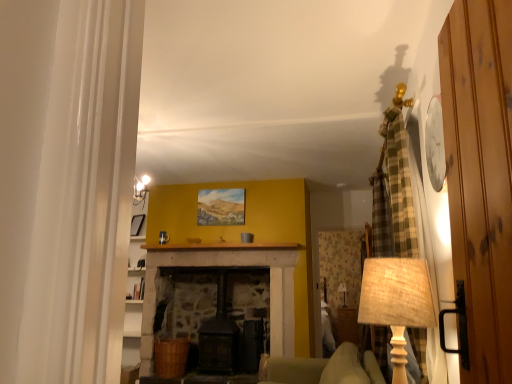
Locate an element on the screen. soft beige fabric armchair at center is located at coordinates (325, 369).

Find the location of `matte black picture frame at left`. matte black picture frame at left is located at coordinates pos(136,224).

You are a GUI agent. You are given a task and a screenshot of the screen. Output one action in this format:
    pyautogui.click(x=<x>, y=<y>)
    Task: Click on the wooden door at right
    
    Given the screenshot: What is the action you would take?
    pyautogui.click(x=480, y=175)

Which object is positioned more to the left, matte beige lampshade at center, which is the 2th table lamp in left-to-right order, or wooden door at right?

From the viewer's perspective, wooden door at right appears more on the left side.

From the image's perspective, does matte beige lampshade at center, which is counted as the second table lamp, starting from the front, appear lower than wooden door at right?

Yes, from the image's perspective, matte beige lampshade at center, which is counted as the second table lamp, starting from the front, is beneath wooden door at right.

Is matte beige lampshade at center, the first table lamp when ordered from back to front, in front of or behind wooden door at right in the image?

matte beige lampshade at center, the first table lamp when ordered from back to front, is behind wooden door at right.

Looking at the image, does matte beige lampshade at center, which is counted as the second table lamp, starting from the front, seem bigger or smaller compared to wooden door at right?

Considering their sizes, matte beige lampshade at center, which is counted as the second table lamp, starting from the front, takes up less space than wooden door at right.

Is burlap lampshade at right, which appears as the first table lamp when viewed from the front, outside of matte beige lampshade at center, which is the 2th table lamp in left-to-right order?

Yes, burlap lampshade at right, which appears as the first table lamp when viewed from the front, is not within matte beige lampshade at center, which is the 2th table lamp in left-to-right order.

From the image's perspective, which is above, burlap lampshade at right, acting as the second table lamp starting from the back, or matte beige lampshade at center, the first table lamp when ordered from back to front?

burlap lampshade at right, acting as the second table lamp starting from the back.

Which of these two, burlap lampshade at right, the 2th table lamp when ordered from bottom to top, or matte beige lampshade at center, which is counted as the second table lamp, starting from the front, is thinner?

matte beige lampshade at center, which is counted as the second table lamp, starting from the front, is thinner.

Considering the relative positions of burlap lampshade at right, marked as the first table lamp in a top-to-bottom arrangement, and matte beige lampshade at center, positioned as the 2th table lamp in top-to-bottom order, in the image provided, is burlap lampshade at right, marked as the first table lamp in a top-to-bottom arrangement, behind matte beige lampshade at center, positioned as the 2th table lamp in top-to-bottom order,?

That is False.

Which of these two, soft beige fabric armchair at center or burlap lampshade at right, which appears as the first table lamp when viewed from the front, is thinner?

Thinner between the two is burlap lampshade at right, which appears as the first table lamp when viewed from the front.

Who is smaller, soft beige fabric armchair at center or burlap lampshade at right, marked as the first table lamp in a top-to-bottom arrangement?

burlap lampshade at right, marked as the first table lamp in a top-to-bottom arrangement, is smaller.

This screenshot has height=384, width=512. Find the location of `armchair that appears below the burlap lampshade at right, acting as the second table lamp starting from the back (from a real-world perspective)`. armchair that appears below the burlap lampshade at right, acting as the second table lamp starting from the back (from a real-world perspective) is located at coordinates (325, 369).

Which object is positioned more to the right, burlap lampshade at right, marked as the first table lamp in a top-to-bottom arrangement, or wooden door at right?

From the viewer's perspective, burlap lampshade at right, marked as the first table lamp in a top-to-bottom arrangement, appears more on the right side.

Does burlap lampshade at right, acting as the second table lamp starting from the back, have a greater width compared to wooden door at right?

Yes, burlap lampshade at right, acting as the second table lamp starting from the back, is wider than wooden door at right.

Can you tell me how much burlap lampshade at right, the 2th table lamp when ordered from bottom to top, and wooden door at right differ in facing direction?

The angle between the facing direction of burlap lampshade at right, the 2th table lamp when ordered from bottom to top, and the facing direction of wooden door at right is 5.11 degrees.

Are burlap lampshade at right, which ranks as the second table lamp in right-to-left order, and wooden door at right located far from each other?

No, burlap lampshade at right, which ranks as the second table lamp in right-to-left order, is not far away from wooden door at right.

From a real-world perspective, who is located higher, burlap lampshade at right, which appears as the first table lamp when viewed from the front, or soft beige fabric armchair at center?

burlap lampshade at right, which appears as the first table lamp when viewed from the front, is physically above.

Between burlap lampshade at right, acting as the second table lamp starting from the back, and soft beige fabric armchair at center, which one is positioned in front?

burlap lampshade at right, acting as the second table lamp starting from the back, is more forward.

Find the location of a particular element. This screenshot has height=384, width=512. armchair that appears on the left of burlap lampshade at right, which ranks as the second table lamp in right-to-left order is located at coordinates (325, 369).

How much distance is there between matte beige lampshade at center, which is the 2th table lamp in left-to-right order, and burlap lampshade at right, which ranks as the second table lamp in right-to-left order?

They are 10.87 feet apart.

Is matte beige lampshade at center, the first table lamp from the right, taller or shorter than burlap lampshade at right, acting as the second table lamp starting from the back?

Clearly, matte beige lampshade at center, the first table lamp from the right, is shorter compared to burlap lampshade at right, acting as the second table lamp starting from the back.

Considering the sizes of objects matte beige lampshade at center, which is counted as the second table lamp, starting from the front, and burlap lampshade at right, acting as the first table lamp starting from the left, in the image provided, who is bigger, matte beige lampshade at center, which is counted as the second table lamp, starting from the front, or burlap lampshade at right, acting as the first table lamp starting from the left,?

burlap lampshade at right, acting as the first table lamp starting from the left.

Between matte beige lampshade at center, the first table lamp when ordered from back to front, and burlap lampshade at right, the 2th table lamp when ordered from bottom to top, which one has smaller width?

matte beige lampshade at center, the first table lamp when ordered from back to front, is thinner.

Is the position of matte black picture frame at left less distant than that of soft beige fabric armchair at center?

No, it is not.

Considering the sizes of objects matte black picture frame at left and soft beige fabric armchair at center in the image provided, who is thinner, matte black picture frame at left or soft beige fabric armchair at center?

matte black picture frame at left.

From the image's perspective, is matte black picture frame at left over soft beige fabric armchair at center?

Yes, from the image's perspective, matte black picture frame at left is on top of soft beige fabric armchair at center.

Is point (135, 219) farther from viewer compared to point (307, 383)?

No, (135, 219) is closer to viewer.

You are a GUI agent. You are given a task and a screenshot of the screen. Output one action in this format:
    pyautogui.click(x=<x>, y=<y>)
    Task: Click on the table lamp that is the 2nd one below the wooden door at right (from a real-world perspective)
    This screenshot has width=512, height=384.
    Given the screenshot: What is the action you would take?
    pyautogui.click(x=343, y=292)

Find the location of `table lamp below the burlap lampshade at right, which appears as the first table lamp when viewed from the front (from the image's perspective)`. table lamp below the burlap lampshade at right, which appears as the first table lamp when viewed from the front (from the image's perspective) is located at coordinates (343, 292).

Based on their spatial positions, is matte black picture frame at left or wooden door at right closer to soft beige fabric armchair at center?

matte black picture frame at left lies closer to soft beige fabric armchair at center than the other object.

From the image, which object appears to be farther from burlap lampshade at right, marked as the first table lamp in a top-to-bottom arrangement, matte black picture frame at left or soft beige fabric armchair at center?

Among the two, soft beige fabric armchair at center is located further to burlap lampshade at right, marked as the first table lamp in a top-to-bottom arrangement.

Estimate the real-world distances between objects in this image. Which object is closer to wooden door at right, soft beige fabric armchair at center or burlap lampshade at right, the 2th table lamp when ordered from bottom to top?

burlap lampshade at right, the 2th table lamp when ordered from bottom to top.

Based on their spatial positions, is burlap lampshade at right, acting as the first table lamp starting from the left, or soft beige fabric armchair at center closer to matte beige lampshade at center, positioned as the 2th table lamp in top-to-bottom order?

soft beige fabric armchair at center is positioned closer to the anchor matte beige lampshade at center, positioned as the 2th table lamp in top-to-bottom order.

When comparing their distances from soft beige fabric armchair at center, does wooden door at right or matte black picture frame at left seem further?

The object further to soft beige fabric armchair at center is wooden door at right.

Looking at the image, which one is located further to wooden door at right, soft beige fabric armchair at center or matte black picture frame at left?

soft beige fabric armchair at center.

When comparing their distances from soft beige fabric armchair at center, does matte beige lampshade at center, positioned as the 2th table lamp in top-to-bottom order, or matte black picture frame at left seem closer?

matte beige lampshade at center, positioned as the 2th table lamp in top-to-bottom order, lies closer to soft beige fabric armchair at center than the other object.

Considering their positions, is soft beige fabric armchair at center positioned further to matte black picture frame at left than burlap lampshade at right, which ranks as the second table lamp in right-to-left order?

soft beige fabric armchair at center.

Where is `armchair between wooden door at right and matte black picture frame at left in the front-back direction`? This screenshot has height=384, width=512. armchair between wooden door at right and matte black picture frame at left in the front-back direction is located at coordinates (325, 369).

At what (x,y) coordinates should I click in order to perform the action: click on armchair between wooden door at right and matte beige lampshade at center, the first table lamp from the right, along the z-axis. Please return your answer as a coordinate pair (x, y). Image resolution: width=512 pixels, height=384 pixels. Looking at the image, I should click on (325, 369).

Identify the location of picture frame located between soft beige fabric armchair at center and matte beige lampshade at center, the 1th table lamp positioned from the bottom, in the depth direction. (136, 224).

Find the location of a particular element. The image size is (512, 384). table lamp positioned between wooden door at right and matte beige lampshade at center, the first table lamp when ordered from back to front, from near to far is located at coordinates (396, 302).